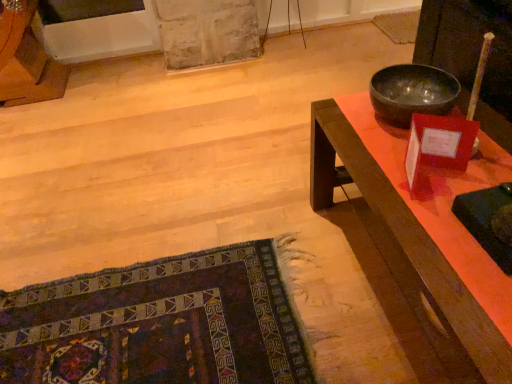
Question: Is wooden desk at right oriented towards shiny metallic bowl at upper right?

Choices:
 (A) yes
 (B) no

Answer: (B)

Question: Is wooden desk at right bigger than shiny metallic bowl at upper right?

Choices:
 (A) no
 (B) yes

Answer: (B)

Question: From a real-world perspective, does wooden desk at right sit lower than shiny metallic bowl at upper right?

Choices:
 (A) yes
 (B) no

Answer: (A)

Question: Is wooden desk at right wider than shiny metallic bowl at upper right?

Choices:
 (A) yes
 (B) no

Answer: (A)

Question: Is wooden desk at right outside shiny metallic bowl at upper right?

Choices:
 (A) no
 (B) yes

Answer: (B)

Question: Is wooden desk at right next to shiny metallic bowl at upper right and touching it?

Choices:
 (A) yes
 (B) no

Answer: (B)

Question: From a real-world perspective, is wooden desk at right physically above dark woven rug at lower left?

Choices:
 (A) no
 (B) yes

Answer: (B)

Question: From the image's perspective, is wooden desk at right under dark woven rug at lower left?

Choices:
 (A) yes
 (B) no

Answer: (B)

Question: Can you confirm if wooden desk at right is positioned to the left of dark woven rug at lower left?

Choices:
 (A) yes
 (B) no

Answer: (B)

Question: Is dark woven rug at lower left surrounded by wooden desk at right?

Choices:
 (A) no
 (B) yes

Answer: (A)

Question: Considering the relative sizes of wooden desk at right and dark woven rug at lower left in the image provided, is wooden desk at right wider than dark woven rug at lower left?

Choices:
 (A) no
 (B) yes

Answer: (A)

Question: Is wooden desk at right not near dark woven rug at lower left?

Choices:
 (A) no
 (B) yes

Answer: (A)

Question: From a real-world perspective, does dark woven rug at lower left stand above shiny metallic bowl at upper right?

Choices:
 (A) no
 (B) yes

Answer: (A)